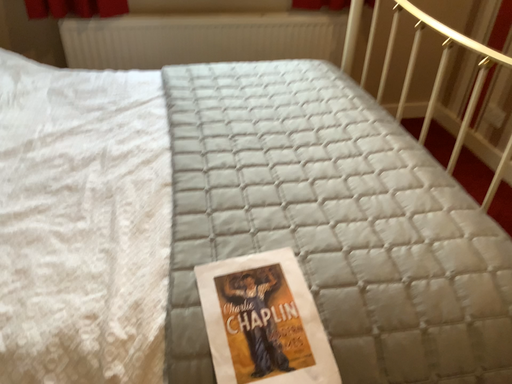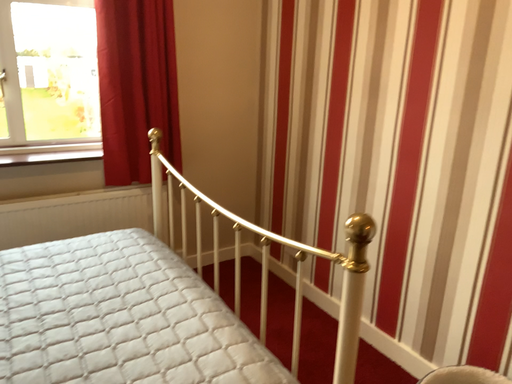
Question: Which way did the camera rotate in the video?

Choices:
 (A) rotated left
 (B) rotated right

Answer: (B)